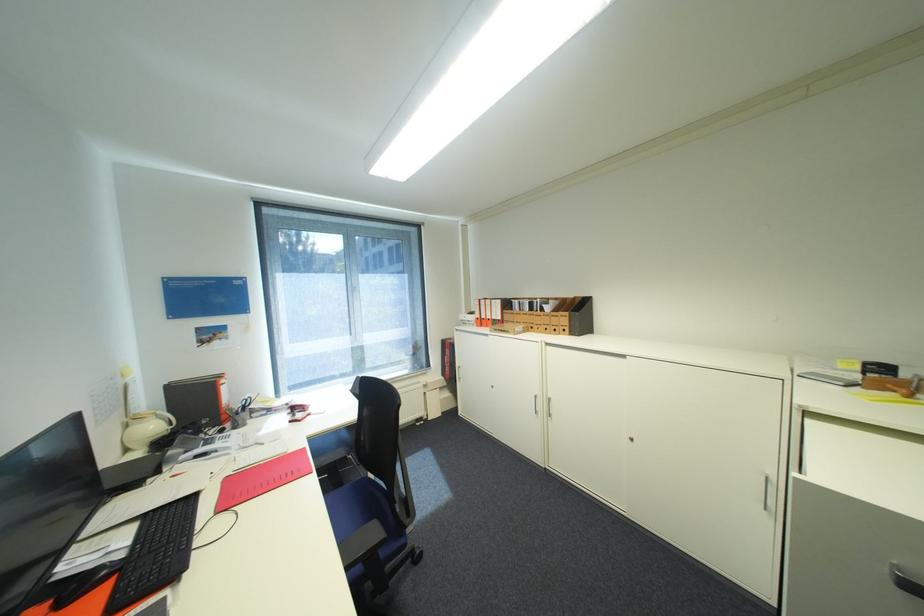
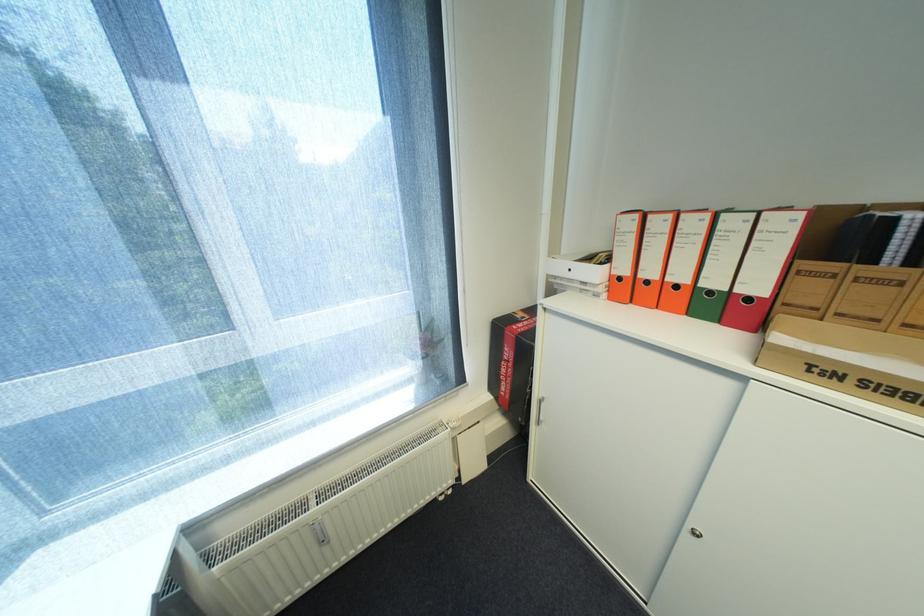
Where in the second image is the point corresponding to [492,320] from the first image?

(655, 283)